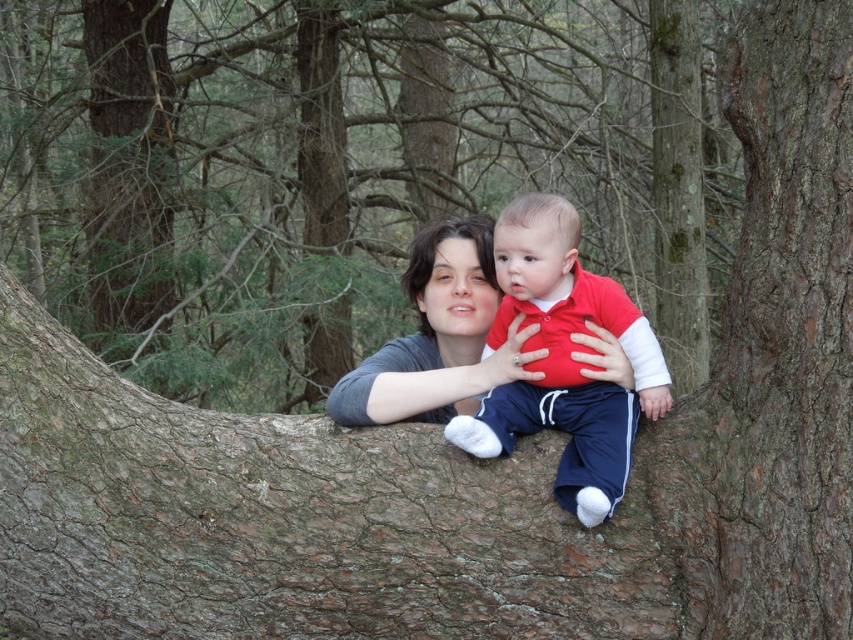
Question: Is matte red shirt at center to the left of matte gray sweater at center from the viewer's perspective?

Choices:
 (A) yes
 (B) no

Answer: (B)

Question: Considering the relative positions of matte red shirt at center and matte gray sweater at center in the image provided, where is matte red shirt at center located with respect to matte gray sweater at center?

Choices:
 (A) below
 (B) above

Answer: (A)

Question: Can you confirm if matte red shirt at center is positioned to the right of matte gray sweater at center?

Choices:
 (A) no
 (B) yes

Answer: (B)

Question: Which object is closer to the camera taking this photo?

Choices:
 (A) matte gray sweater at center
 (B) matte red shirt at center

Answer: (B)

Question: Among these points, which one is nearest to the camera?

Choices:
 (A) (576, 410)
 (B) (340, 387)

Answer: (A)

Question: Which point appears closest to the camera in this image?

Choices:
 (A) (512, 310)
 (B) (489, 256)

Answer: (A)